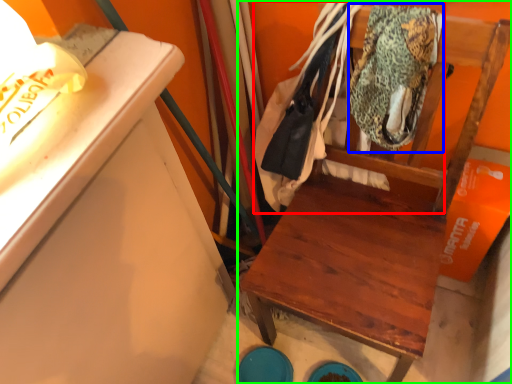
Question: Which is nearer to the laundry (highlighted by a red box)? clothing (highlighted by a blue box) or furniture (highlighted by a green box).

Choices:
 (A) clothing
 (B) furniture

Answer: (A)